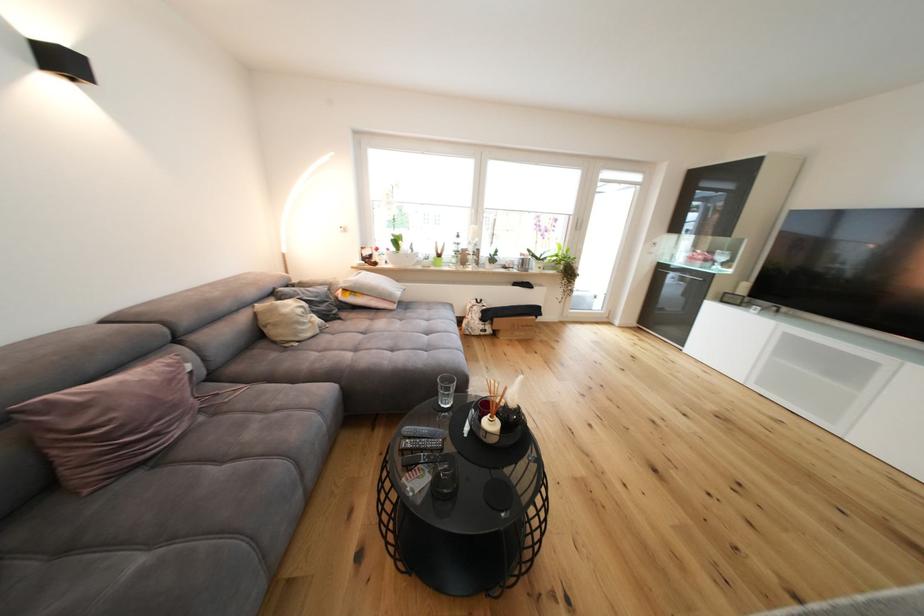
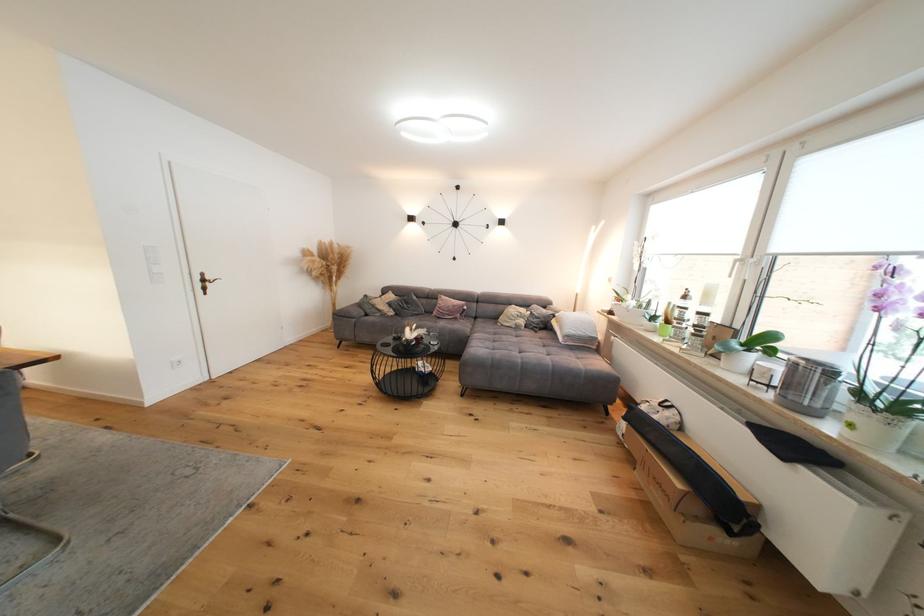
Find the pixel in the second image that matches point (329, 331) in the first image.

(524, 330)